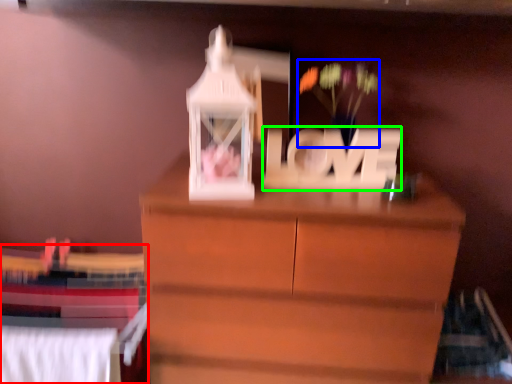
Question: Which object is the farthest from bed (highlighted by a red box)? Choose among these: floral arrangement (highlighted by a blue box) or letter (highlighted by a green box).

Choices:
 (A) floral arrangement
 (B) letter

Answer: (A)